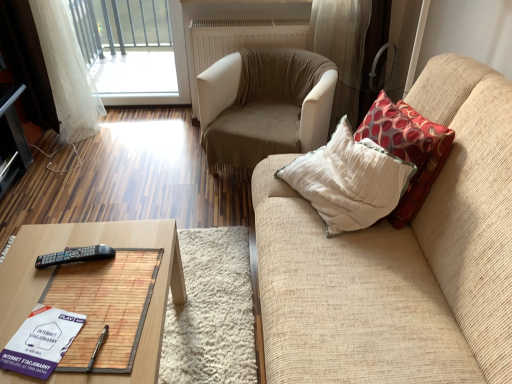
Question: From the image's perspective, is purple paper book at lower left above or below transparent glass window at upper left?

Choices:
 (A) below
 (B) above

Answer: (A)

Question: Is purple paper book at lower left in front of or behind transparent glass window at upper left in the image?

Choices:
 (A) front
 (B) behind

Answer: (A)

Question: Considering the real-world distances, which object is closest to the transparent glass window at upper left?

Choices:
 (A) beige fabric armchair at center
 (B) woodenwoodentable at lower left
 (C) red patterned fabric pillow at right
 (D) purple paper book at lower left
 (E) black plastic remote at lower left

Answer: (A)

Question: Considering the real-world distances, which object is farthest from the beige fabric armchair at center?

Choices:
 (A) transparent glass window at upper left
 (B) woodenwoodentable at lower left
 (C) beige fabric couch at right
 (D) black glossy tv stand at left
 (E) red patterned fabric pillow at right

Answer: (D)